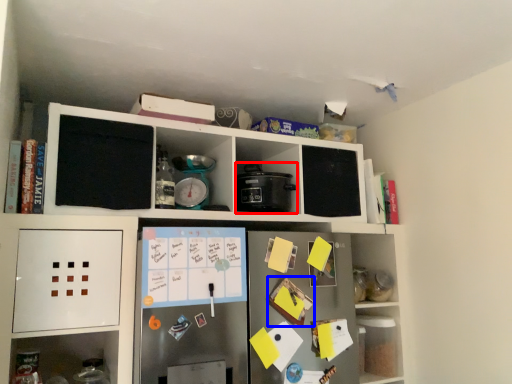
Question: Which object is further to the camera taking this photo, appliance (highlighted by a red box) or book (highlighted by a blue box)?

Choices:
 (A) appliance
 (B) book

Answer: (A)